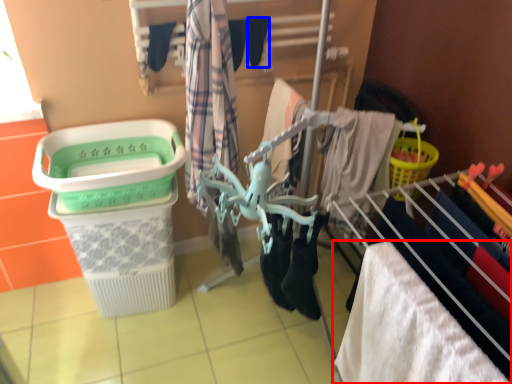
Question: Which point is further to the camera, towel (highlighted by a red box) or shoe (highlighted by a blue box)?

Choices:
 (A) towel
 (B) shoe

Answer: (B)